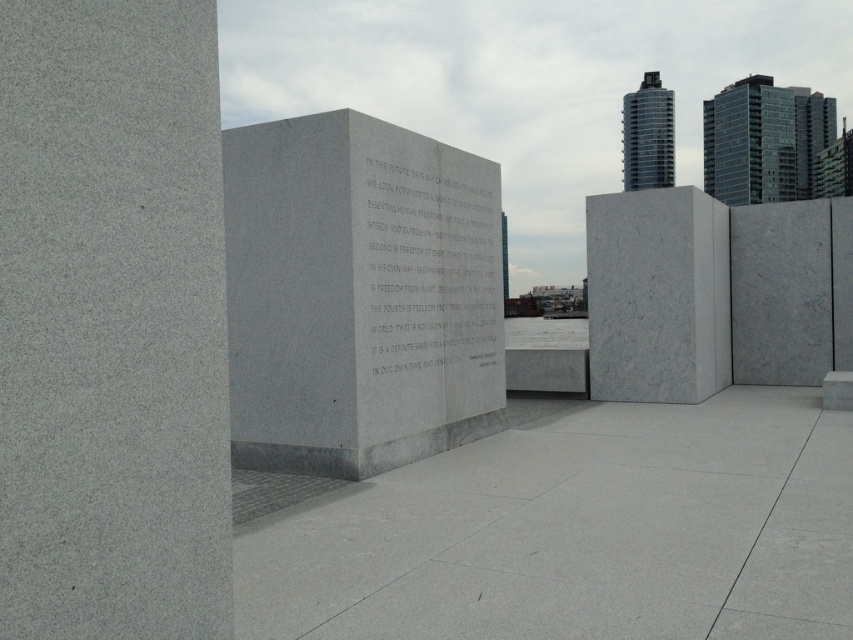
Does gray polished concrete at center appear on the right side of white marble stone at center?

Correct, you'll find gray polished concrete at center to the right of white marble stone at center.

Between point (654, 452) and point (379, 256), which one is positioned behind?

The point (654, 452) is behind.

Where is `gray polished concrete at center`? The image size is (853, 640). gray polished concrete at center is located at coordinates (572, 531).

What do you see at coordinates (358, 296) in the screenshot? I see `white marble monument at center` at bounding box center [358, 296].

Which is in front, point (376, 269) or point (679, 378)?

Positioned in front is point (376, 269).

Locate an element on the screen. The height and width of the screenshot is (640, 853). white marble monument at center is located at coordinates (358, 296).

Does gray granite pillar at center have a greater height compared to white marble monument at center?

Incorrect, gray granite pillar at center's height is not larger of white marble monument at center's.

Between point (196, 349) and point (430, 282), which one is positioned behind?

The point (430, 282) is behind.

Locate an element on the screen. This screenshot has height=640, width=853. gray granite pillar at center is located at coordinates (112, 323).